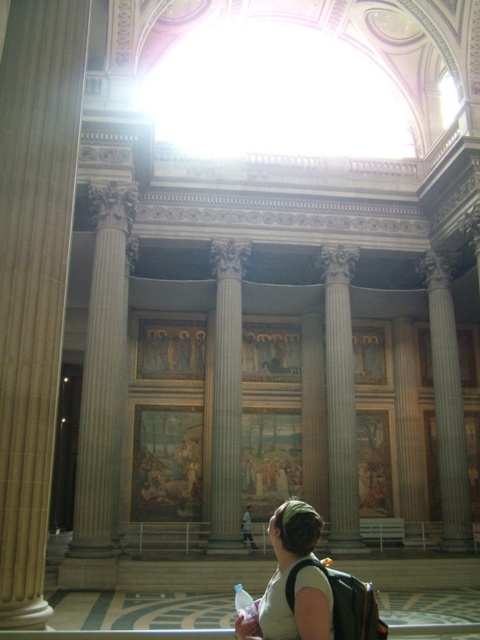
Question: Is smooth beige column at left in front of gray marble column at center?

Choices:
 (A) yes
 (B) no

Answer: (A)

Question: Which point appears closest to the camera in this image?

Choices:
 (A) (324, 627)
 (B) (222, 474)
 (C) (456, 380)
 (D) (310, 454)

Answer: (A)

Question: Which point is farther from the camera taking this photo?

Choices:
 (A) (95, 481)
 (B) (409, 444)
 (C) (211, 499)

Answer: (B)

Question: In this image, where is smooth marble column at center located relative to white marble column at center?

Choices:
 (A) left
 (B) right

Answer: (A)

Question: Is light beige t-shirt at center positioned behind gray marble column at center?

Choices:
 (A) yes
 (B) no

Answer: (B)

Question: Which of these objects is positioned closest to the gray marble column at right?

Choices:
 (A) smooth marble column at center
 (B) smooth beige column at left
 (C) satin gold column at center
 (D) white marble column at center

Answer: (C)